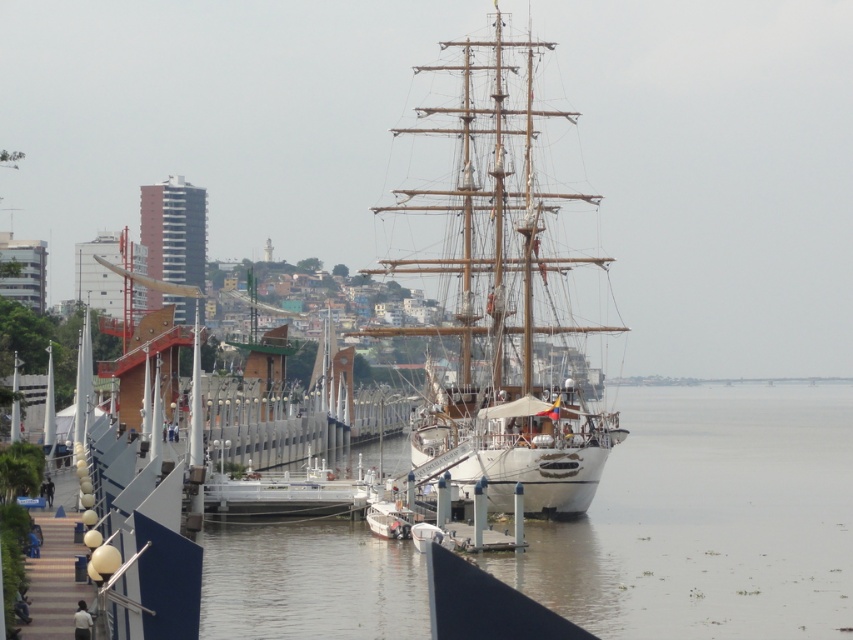
You are standing on the waterfront promenade and want to walk towards the ship. There are two points marked on the ground ahead of you. The first point is at coordinate point [300,556] and the second is at point [596,426]. Which point should you aim for if you want to reach the ship first?

You should aim for point [300,556] because it is in front of point [596,426], meaning it is closer to the ship.

You are standing on the modern waterfront promenade and see the wooden ship at center and the brown murky water at center. Which object is positioned to the right of the other?

The brown murky water at center is to the right of wooden ship at center.

You are standing on the modern waterfront promenade and see the wooden ship at center and the brown murky water at center. Which object is positioned lower in the scene?

The brown murky water at center is located below the wooden ship at center, so it is positioned lower in the scene.